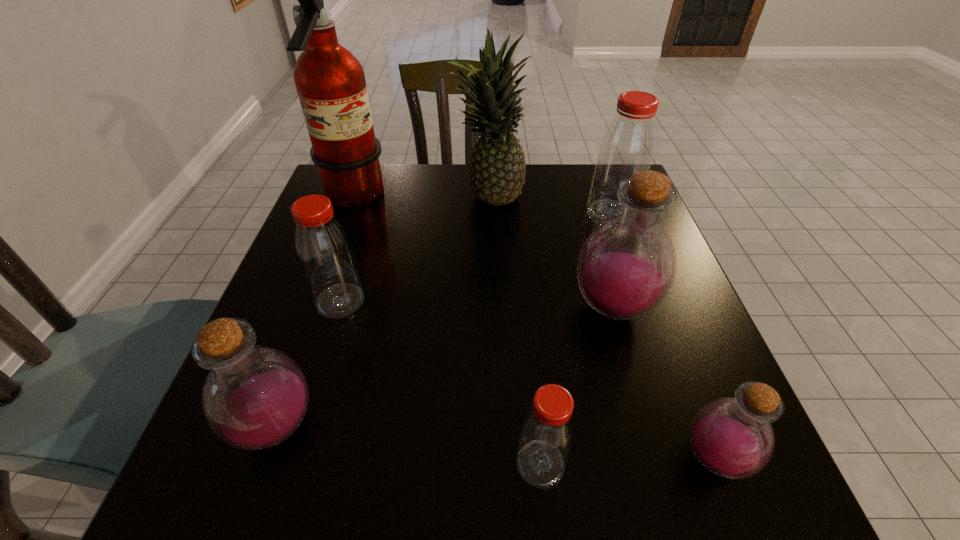
This screenshot has height=540, width=960. Find the location of `the fourth bottle from right to left`. the fourth bottle from right to left is located at coordinates (547, 432).

In order to click on the smallest purple bottle in this screenshot , I will do (732, 438).

This screenshot has width=960, height=540. Identify the location of free region located on the nozzle and handle of the tallest object. (442, 198).

I want to click on free space located 0.210m on the front of the pineapple, so click(491, 281).

Find the location of a particular element. blank area located on the back of the biggest red bottle is located at coordinates (601, 188).

The width and height of the screenshot is (960, 540). In order to click on free space located on the front of the farthest purple bottle in this screenshot , I will do `click(662, 477)`.

Find the location of a particular element. This screenshot has height=540, width=960. vacant area situated 0.050m on the front of the second smallest red bottle is located at coordinates pyautogui.click(x=328, y=340).

The width and height of the screenshot is (960, 540). Find the location of `vacant area located 0.120m on the back of the second smallest purple bottle`. vacant area located 0.120m on the back of the second smallest purple bottle is located at coordinates (309, 334).

At what (x,y) coordinates should I click in order to perform the action: click on vacant area located 0.050m on the left of the smallest red bottle. Please return your answer as a coordinate pair (x, y). Image resolution: width=960 pixels, height=540 pixels. Looking at the image, I should click on (483, 464).

Locate an element on the screen. vacant space situated 0.230m on the back of the smallest purple bottle is located at coordinates (660, 318).